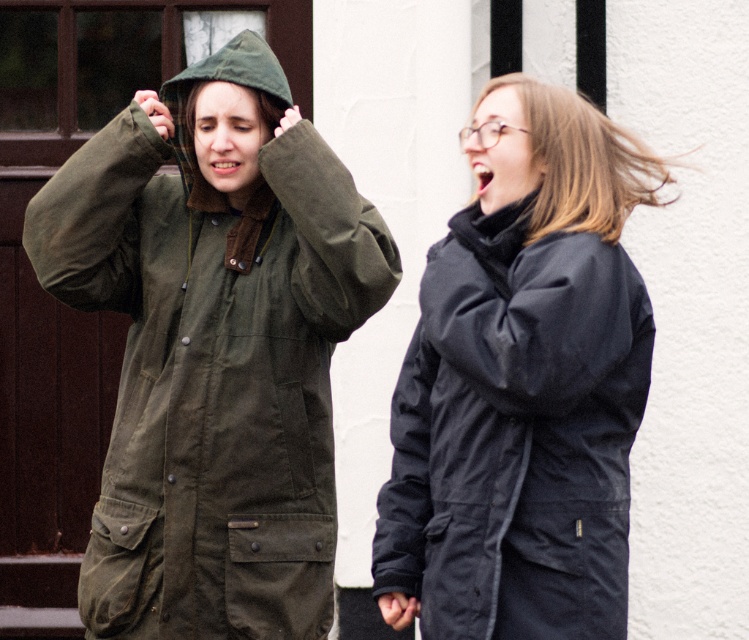
You are a photographer trying to capture the olive green waxed canvas trench coat at left in the image. You want to ensure the entire coat is visible in your photo. Given that your camera has a maximum zoom range of 50 meters, what is the minimum distance you need to be from the point at coordinates (213, 348) to capture the coat without cropping?

The olive green waxed canvas trench coat at left is located at point (213, 348). To capture the entire coat without cropping, you must be at least 50 meters away from this point, as your camera can zoom up to 50 meters. However, since the exact dimensions of the coat are not provided, this is an approximate guideline.

You are a tailor who needs to determine which coat requires more fabric for alterations. Based on the image, which coat between the olive green waxed canvas trench coat at left and the matte black coat at right would need more fabric due to its size?

The olive green waxed canvas trench coat at left requires more fabric for alterations because its width is larger than the matte black coat at right.

You are a fashion designer observing two coats in an outdoor setting. The olive green waxed canvas trench coat at left and the matte black coat at right. Which coat would you recommend for someone who needs more coverage from the elements, and why?

The olive green waxed canvas trench coat at left has a larger size compared to matte black coat at right, providing more coverage from the elements due to its size and design features like a hood and flap closures mentioned in the scene description.